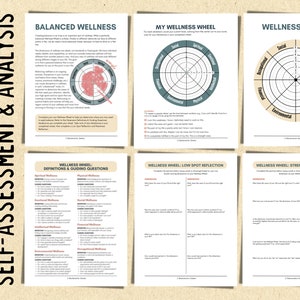
Where is `piece of paper`? piece of paper is located at coordinates (229, 18), (117, 20), (258, 122), (123, 157), (148, 156), (254, 157).